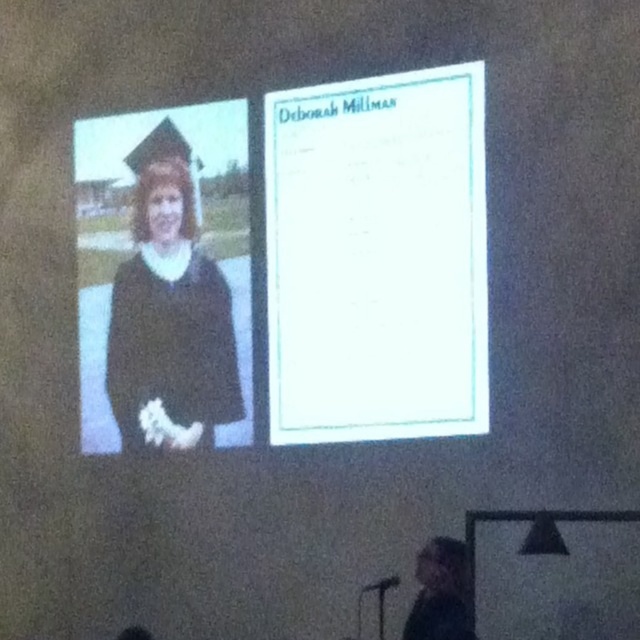
Can you confirm if white paper at upper center is wider than matte black gown at left?

Indeed, white paper at upper center has a greater width compared to matte black gown at left.

In the scene shown: Who is positioned more to the left, white paper at upper center or matte black gown at left?

matte black gown at left

Who is more distant from viewer, (413, 404) or (147, 266)?

Positioned behind is point (147, 266).

Find the location of `white paper at upper center`. white paper at upper center is located at coordinates (376, 257).